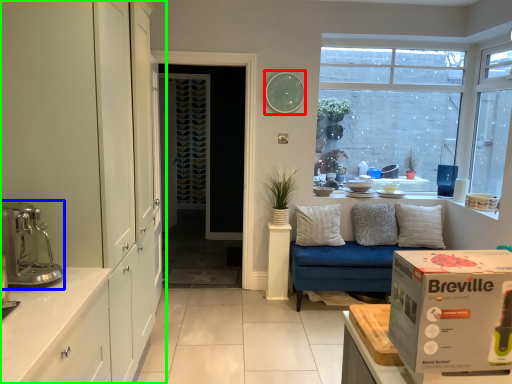
Question: Considering the real-world distances, which object is farthest from clock (highlighted by a red box)? coffee machine (highlighted by a blue box) or dresser (highlighted by a green box)?

Choices:
 (A) coffee machine
 (B) dresser

Answer: (A)